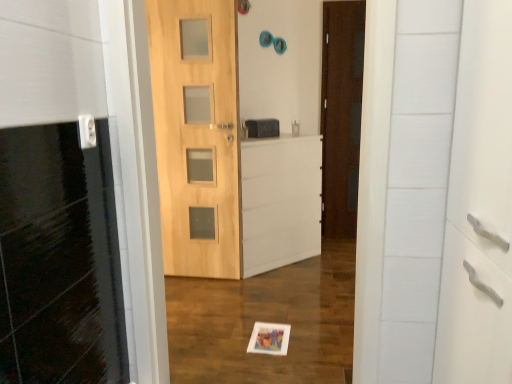
You are a GUI agent. You are given a task and a screenshot of the screen. Output one action in this format:
    pyautogui.click(x=<x>, y=<y>)
    Task: Click on the vacant area in front of natural wood door at center, marked as the 2th door in a right-to-left arrangement
    This screenshot has width=512, height=384.
    Given the screenshot: What is the action you would take?
    pyautogui.click(x=195, y=301)